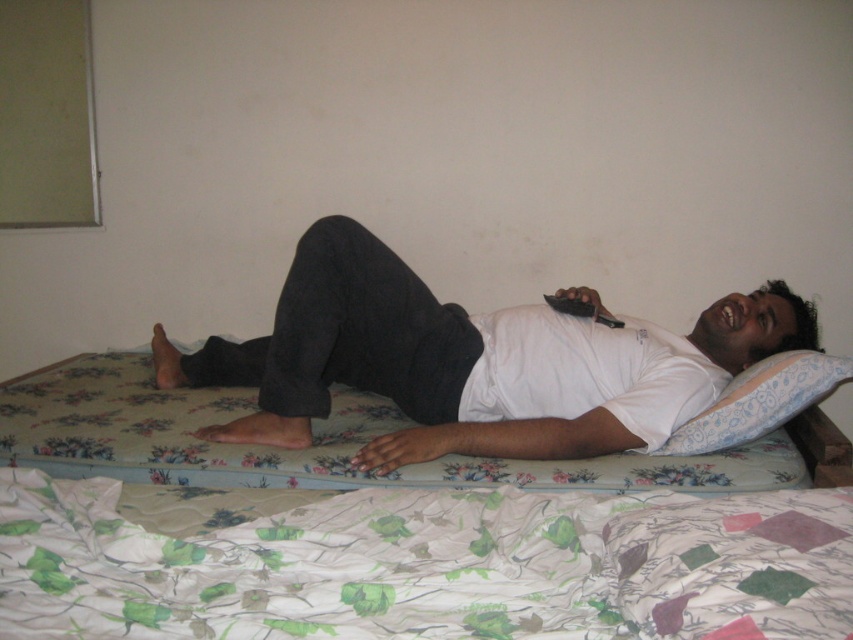
You are a interior designer planning to add a new piece of furniture to the room. You have a small table that needs to be placed between the green floral fabric at lower center and the floral fabric pillow at upper right. Can you place it there?

The green floral fabric at lower center is in front of the floral fabric pillow at upper right, so there is no space between them for the table to be placed.

You are standing in the room and want to reach the green floral fabric at lower center to adjust it. Considering the distance, can you comfortably reach it without moving closer?

The green floral fabric at lower center is 28.31 inches away from you, so yes, you can comfortably reach it without needing to move closer.

In the scene shown: You are a photographer trying to capture a closeup of the white matte shirt at center and the floral fabric mattress at center. Which object should you focus on first if you want to ensure both are in focus without moving the camera?

You should focus on the white matte shirt at center first because it is closer to the viewer than the floral fabric mattress at center, so by focusing on the closer object, the farther one will also be in focus within the depth of field.